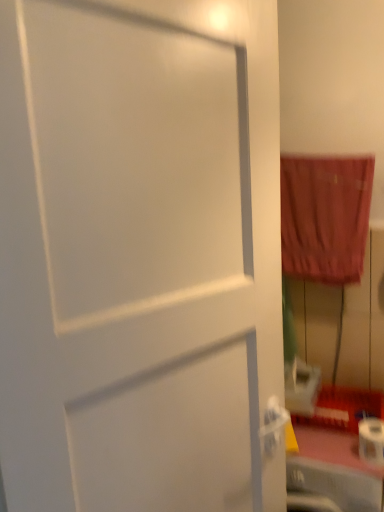
Question: Looking at their shapes, would you say velvet-like red curtain at right is wider or thinner than white matte toilet paper at lower right?

Choices:
 (A) thin
 (B) wide

Answer: (A)

Question: Would you say velvet-like red curtain at right is to the left or to the right of white matte toilet paper at lower right in the picture?

Choices:
 (A) right
 (B) left

Answer: (B)

Question: From the image's perspective, relative to white matte toilet paper at lower right, is velvet-like red curtain at right above or below?

Choices:
 (A) below
 (B) above

Answer: (B)

Question: In terms of size, does white matte toilet paper at lower right appear bigger or smaller than velvet-like red curtain at right?

Choices:
 (A) big
 (B) small

Answer: (B)

Question: From a real-world perspective, is white matte toilet paper at lower right physically located above or below velvet-like red curtain at right?

Choices:
 (A) above
 (B) below

Answer: (B)

Question: Relative to velvet-like red curtain at right, is white matte toilet paper at lower right in front or behind?

Choices:
 (A) behind
 (B) front

Answer: (B)

Question: From the image's perspective, is white matte toilet paper at lower right positioned above or below velvet-like red curtain at right?

Choices:
 (A) above
 (B) below

Answer: (B)